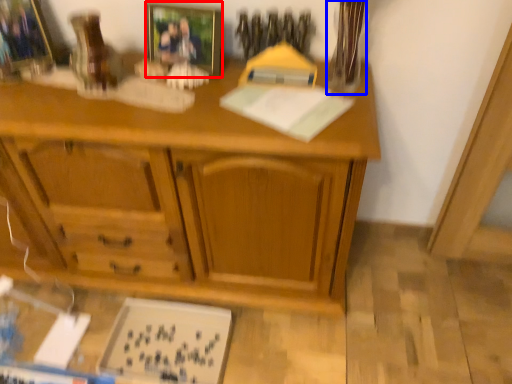
Question: Which object is further to the camera taking this photo, picture frame (highlighted by a red box) or glass vase (highlighted by a blue box)?

Choices:
 (A) picture frame
 (B) glass vase

Answer: (A)